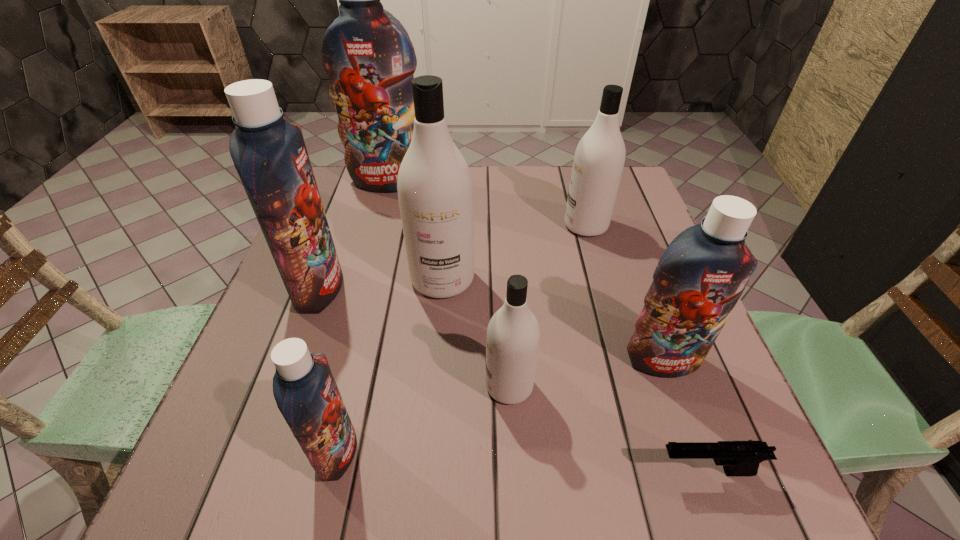
Where is `the nearest blue shampoo`? This screenshot has height=540, width=960. the nearest blue shampoo is located at coordinates (304, 388).

Image resolution: width=960 pixels, height=540 pixels. In order to click on the smallest white shampoo in this screenshot , I will do `click(513, 334)`.

The width and height of the screenshot is (960, 540). In order to click on the third shampoo from right to left in this screenshot , I will do pos(513,334).

Where is `the shortest object`? The height and width of the screenshot is (540, 960). the shortest object is located at coordinates (739, 458).

The width and height of the screenshot is (960, 540). Identify the location of pistol. (739, 458).

The height and width of the screenshot is (540, 960). I want to click on vacant point located 0.350m on the front label of the biggest blue shampoo, so click(x=362, y=279).

The image size is (960, 540). What are the coordinates of `vacant region located on the front label of the second biggest blue shampoo` in the screenshot? It's located at (377, 288).

The width and height of the screenshot is (960, 540). Find the location of `free location located on the front-facing side of the second nearest white shampoo`. free location located on the front-facing side of the second nearest white shampoo is located at coordinates (432, 401).

Identify the location of free space located 0.370m on the front-facing side of the second smallest white shampoo. Image resolution: width=960 pixels, height=540 pixels. (423, 226).

Identify the location of free space located on the front-facing side of the second smallest white shampoo. The width and height of the screenshot is (960, 540). (431, 226).